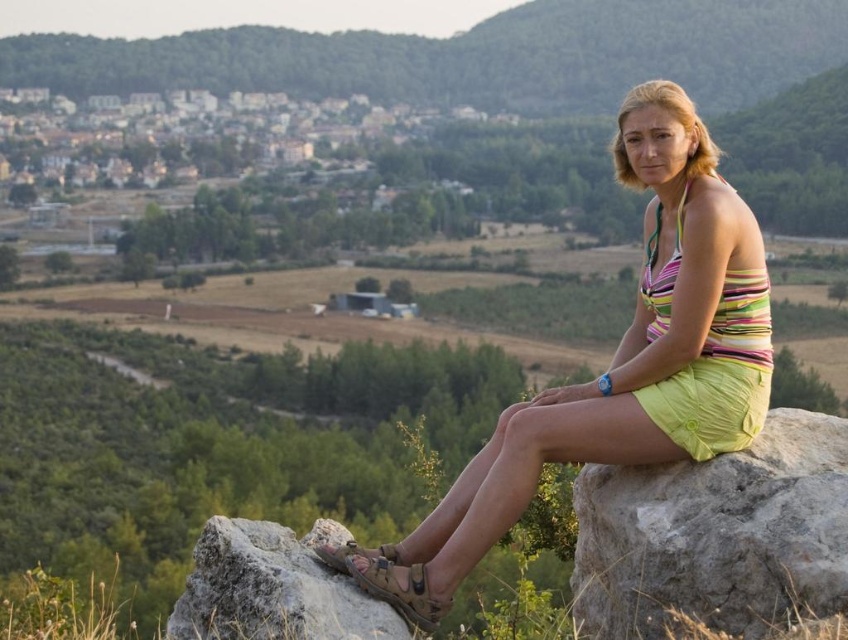
Question: Based on their relative distances, which object is nearer to the brown suede sandal at lower center?

Choices:
 (A) striped fabric dress at center
 (B) yellow cotton shorts at center
 (C) green forested mountain at upper center

Answer: (B)

Question: Which object is farther from the camera taking this photo?

Choices:
 (A) yellow fabric shorts at right
 (B) brown suede sandal at lower center
 (C) brown leather sandal at lower center

Answer: (A)

Question: Which object appears farthest from the camera in this image?

Choices:
 (A) yellow cotton shorts at center
 (B) brown leather sandal at lower center

Answer: (A)

Question: Is green forested mountain at upper center above brown suede sandal at lower center?

Choices:
 (A) yes
 (B) no

Answer: (A)

Question: Does rough textured rock at lower left have a larger size compared to yellow fabric shorts at right?

Choices:
 (A) no
 (B) yes

Answer: (B)

Question: Does green forested mountain at upper center have a lesser width compared to brown suede sandal at lower center?

Choices:
 (A) yes
 (B) no

Answer: (B)